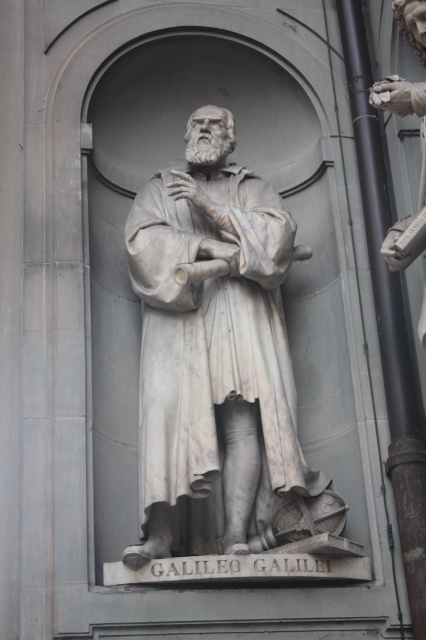
Question: Which point is farther to the camera?

Choices:
 (A) (379, 90)
 (B) (172, 186)

Answer: (B)

Question: Can you confirm if white marble statue at center is positioned to the left of polished bronze hand at upper right?

Choices:
 (A) no
 (B) yes

Answer: (B)

Question: Does white marble statue at center come behind polished bronze hand at upper right?

Choices:
 (A) yes
 (B) no

Answer: (B)

Question: Is white marble statue at center to the right of polished bronze hand at upper right from the viewer's perspective?

Choices:
 (A) no
 (B) yes

Answer: (A)

Question: Which point is closer to the camera?

Choices:
 (A) pos(245,355)
 (B) pos(400,84)

Answer: (B)